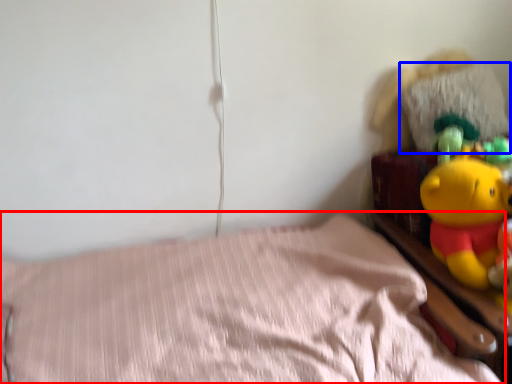
Question: Which object is closer to the camera taking this photo, bed (highlighted by a red box) or pillow (highlighted by a blue box)?

Choices:
 (A) bed
 (B) pillow

Answer: (A)